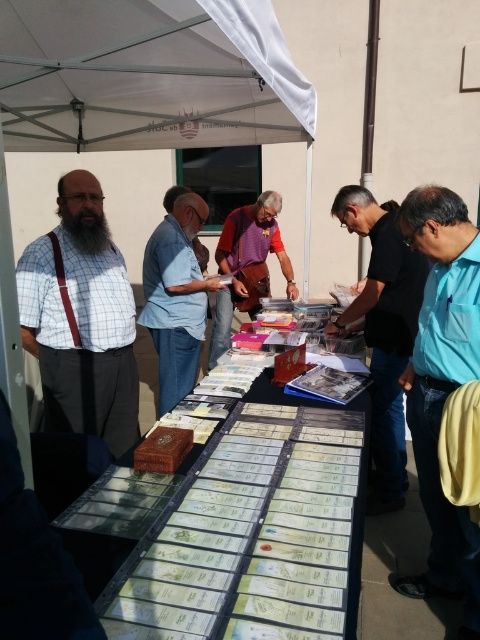
Question: Estimate the real-world distances between objects in this image. Which object is closer to the white fabric canopy at upper center?

Choices:
 (A) blue cotton shirt at center
 (B) matte plaid shirt at left

Answer: (A)

Question: Among these points, which one is nearest to the camera?

Choices:
 (A) (237, 109)
 (B) (434, 272)

Answer: (B)

Question: Can you confirm if matte plaid shirt at left is positioned to the left of black matte shirt at center?

Choices:
 (A) no
 (B) yes

Answer: (B)

Question: Which object is the farthest from the clear plastic table at center?

Choices:
 (A) blue cotton shirt at center
 (B) matte plaid shirt at left
 (C) purple woven bag at center

Answer: (C)

Question: Is clear plastic table at center above blue cotton shirt at center?

Choices:
 (A) yes
 (B) no

Answer: (B)

Question: Is white fabric canopy at upper center closer to the viewer compared to black matte shirt at center?

Choices:
 (A) no
 (B) yes

Answer: (B)